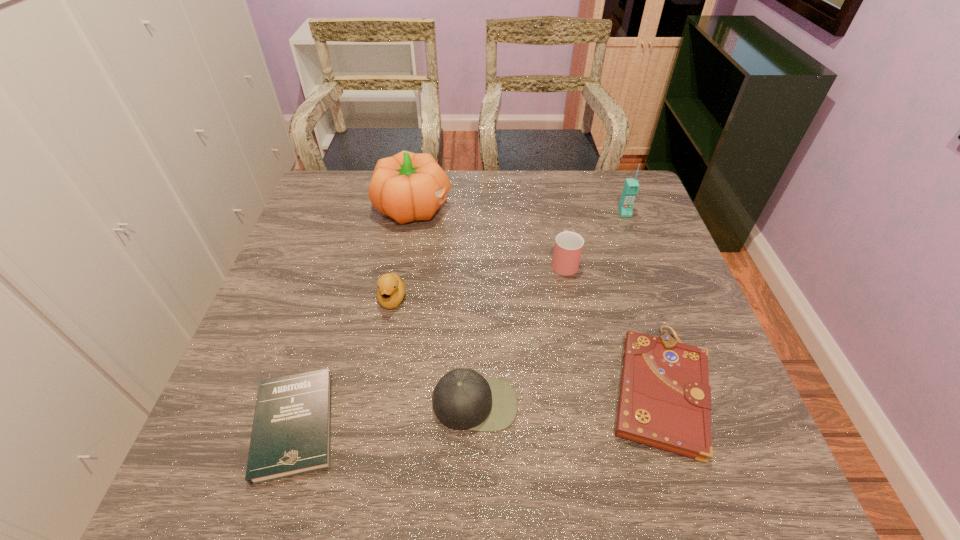
In order to click on pumpkin in this screenshot , I will do `click(407, 186)`.

The image size is (960, 540). I want to click on cellular telephone, so click(x=631, y=186).

This screenshot has width=960, height=540. Identify the location of the fourth farthest object. (391, 288).

The width and height of the screenshot is (960, 540). Identify the location of cup. (568, 247).

Identify the location of cap. (463, 399).

Locate an element on the screen. notebook is located at coordinates (665, 399).

This screenshot has width=960, height=540. Identify the location of the shortest object. (291, 435).

Locate an element on the screen. Image resolution: width=960 pixels, height=540 pixels. vacant point located on the carved face of the pumpkin is located at coordinates (583, 207).

At what (x,y) coordinates should I click in order to perform the action: click on vacant area situated 0.060m on the keypad of the cellular telephone. Please return your answer as a coordinate pair (x, y). Image resolution: width=960 pixels, height=540 pixels. Looking at the image, I should click on (631, 231).

The height and width of the screenshot is (540, 960). I want to click on vacant space located 0.310m on the face of the fourth farthest object, so click(x=367, y=442).